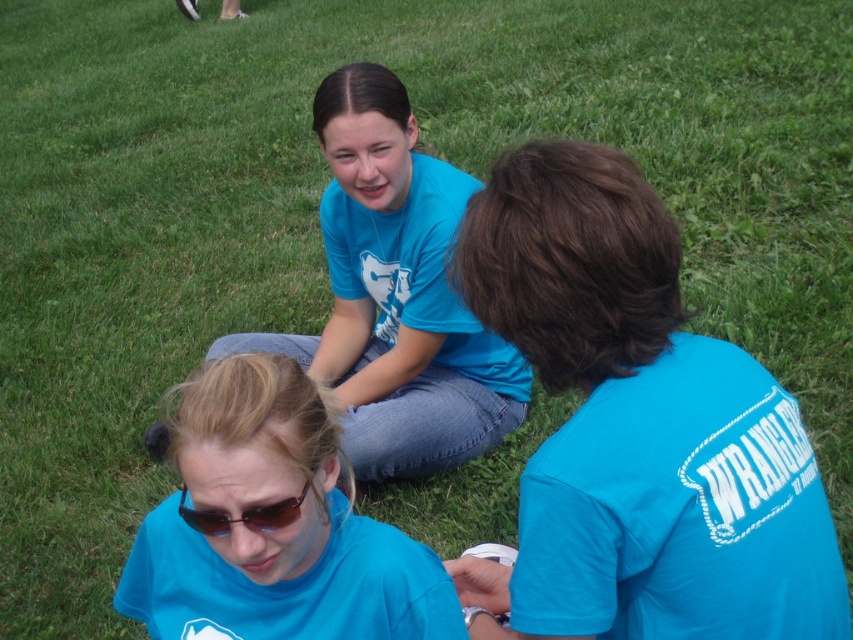
Question: Among these points, which one is nearest to the camera?

Choices:
 (A) (152, 637)
 (B) (498, 344)
 (C) (527, 474)
 (D) (244, 516)

Answer: (C)

Question: Estimate the real-world distances between objects in this image. Which object is farther from the matte blue shirt at center?

Choices:
 (A) matte blue shirt at lower center
 (B) sunglasses at center

Answer: (B)

Question: Does matte blue shirt at lower center have a lesser width compared to matte blue t-shirt at center?

Choices:
 (A) yes
 (B) no

Answer: (A)

Question: Is matte blue shirt at center bigger than matte blue t-shirt at center?

Choices:
 (A) yes
 (B) no

Answer: (B)

Question: Which object appears closest to the camera in this image?

Choices:
 (A) matte blue shirt at center
 (B) sunglasses at center

Answer: (A)

Question: Does matte blue shirt at lower center have a greater width compared to sunglasses at center?

Choices:
 (A) yes
 (B) no

Answer: (A)